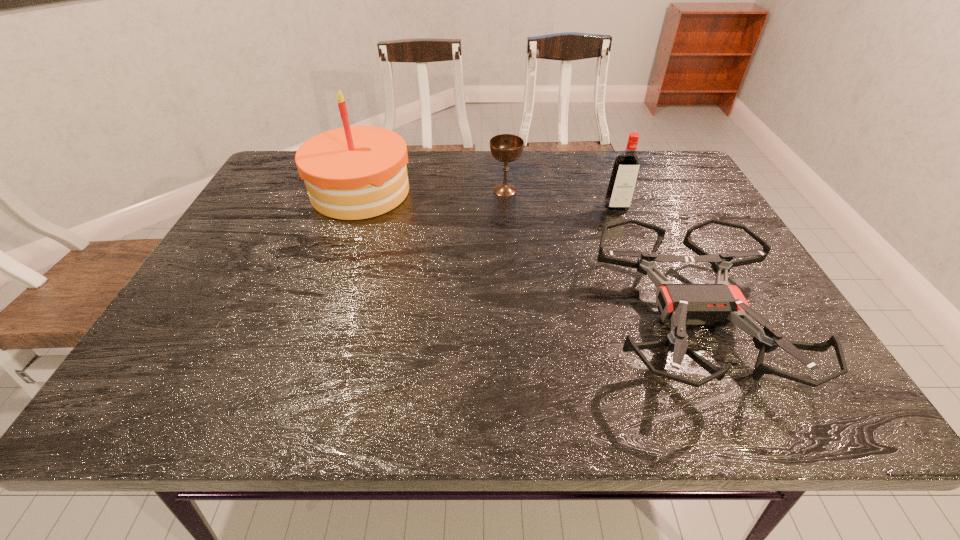
You are a GUI agent. You are given a task and a screenshot of the screen. Output one action in this format:
    pyautogui.click(x=<x>, y=<y>)
    Task: Click on the birthday cake that is at the far edge
    This screenshot has width=960, height=540.
    Given the screenshot: What is the action you would take?
    pyautogui.click(x=355, y=172)

The width and height of the screenshot is (960, 540). What are the coordinates of `chalice positioned at the far edge` in the screenshot? It's located at (505, 148).

This screenshot has width=960, height=540. Find the location of `object present at the near edge`. object present at the near edge is located at coordinates (717, 304).

Identify the location of object that is positioned at the left edge. (355, 172).

Locate an element on the screen. This screenshot has width=960, height=540. object situated at the right edge is located at coordinates (x=717, y=304).

Where is `object that is positioned at the far left corner`? This screenshot has height=540, width=960. object that is positioned at the far left corner is located at coordinates (355, 172).

I want to click on object positioned at the near right corner, so 717,304.

Image resolution: width=960 pixels, height=540 pixels. What are the coordinates of `free space at the far edge` in the screenshot? It's located at (609, 161).

Find the location of a particular element. The width and height of the screenshot is (960, 540). vacant region at the near edge of the desktop is located at coordinates (247, 381).

The image size is (960, 540). I want to click on vacant space at the left edge of the desktop, so click(x=214, y=285).